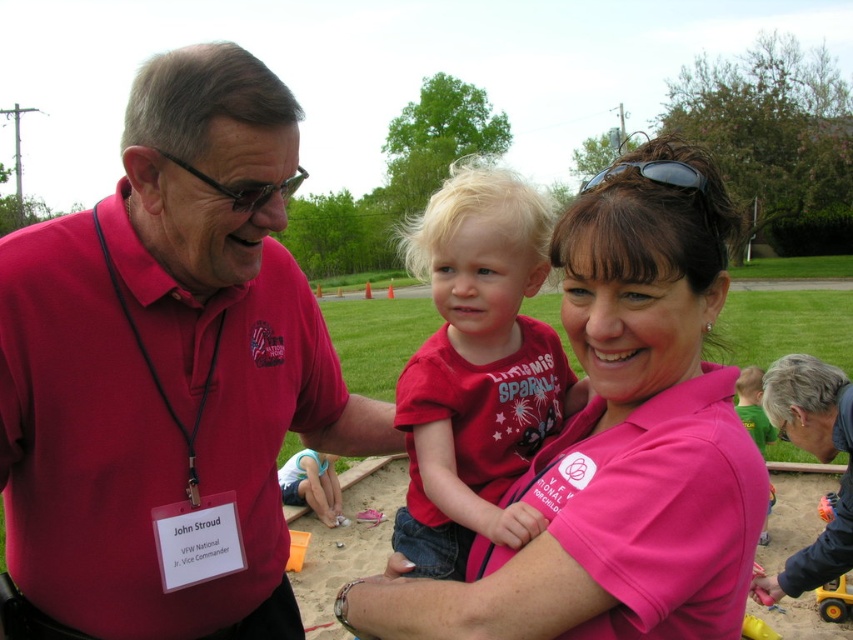
Question: Does pink cotton shirt at center have a greater width compared to matte red shirt at center?

Choices:
 (A) no
 (B) yes

Answer: (B)

Question: Does pink cotton shirt at center have a smaller size compared to matte red shirt at center?

Choices:
 (A) no
 (B) yes

Answer: (B)

Question: Which of the following is the farthest from the observer?

Choices:
 (A) matte red shirt at center
 (B) sunglasses at center
 (C) pink cotton shirt at center
 (D) matte red shirt at left

Answer: (A)

Question: Which object is farther from the camera taking this photo?

Choices:
 (A) pink fabric shirt at center
 (B) sunglasses at center

Answer: (A)

Question: Which object is positioned farthest from the matte red shirt at center?

Choices:
 (A) pink cotton shirt at center
 (B) pink fabric shirt at center

Answer: (B)

Question: Is matte red shirt at left to the right of pink fabric shirt at center from the viewer's perspective?

Choices:
 (A) no
 (B) yes

Answer: (A)